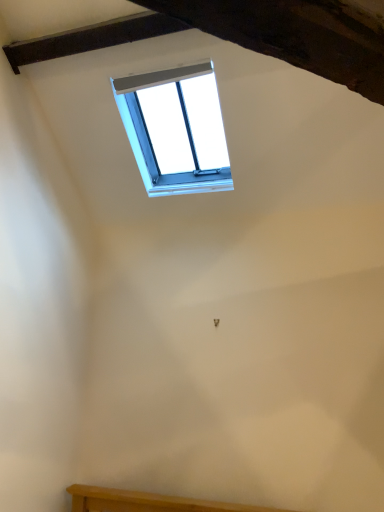
Where is `clear glass window at upper center`? The height and width of the screenshot is (512, 384). clear glass window at upper center is located at coordinates (176, 129).

This screenshot has height=512, width=384. What do you see at coordinates (176, 129) in the screenshot?
I see `clear glass window at upper center` at bounding box center [176, 129].

What are the coordinates of `clear glass window at upper center` in the screenshot? It's located at (176, 129).